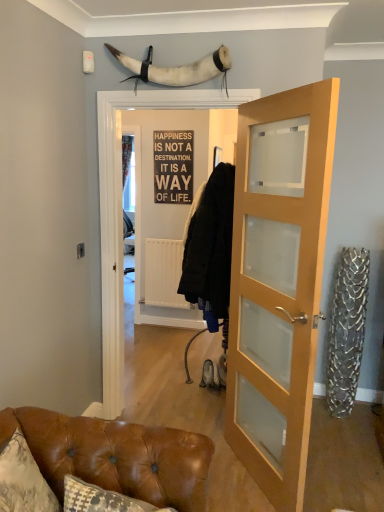
Question: Does white fur horn at upper center have a larger size compared to light wood/glass door at center?

Choices:
 (A) no
 (B) yes

Answer: (A)

Question: From a real-world perspective, is white fur horn at upper center over light wood/glass door at center?

Choices:
 (A) no
 (B) yes

Answer: (B)

Question: Considering the relative sizes of white fur horn at upper center and light wood/glass door at center in the image provided, is white fur horn at upper center wider than light wood/glass door at center?

Choices:
 (A) yes
 (B) no

Answer: (A)

Question: From the image's perspective, is white fur horn at upper center above light wood/glass door at center?

Choices:
 (A) yes
 (B) no

Answer: (A)

Question: Would you say white fur horn at upper center is outside light wood/glass door at center?

Choices:
 (A) yes
 (B) no

Answer: (A)

Question: Could you tell me if white fur horn at upper center is turned towards light wood/glass door at center?

Choices:
 (A) yes
 (B) no

Answer: (B)

Question: From the image's perspective, does white fur horn at upper center appear lower than brown leather couch at lower left?

Choices:
 (A) no
 (B) yes

Answer: (A)

Question: Is white fur horn at upper center positioned before brown leather couch at lower left?

Choices:
 (A) yes
 (B) no

Answer: (B)

Question: Is white fur horn at upper center smaller than brown leather couch at lower left?

Choices:
 (A) no
 (B) yes

Answer: (A)

Question: Is white fur horn at upper center looking in the opposite direction of brown leather couch at lower left?

Choices:
 (A) yes
 (B) no

Answer: (B)

Question: Can you confirm if white fur horn at upper center is taller than brown leather couch at lower left?

Choices:
 (A) yes
 (B) no

Answer: (A)

Question: Is white fur horn at upper center surrounding brown leather couch at lower left?

Choices:
 (A) no
 (B) yes

Answer: (A)

Question: Does metallic sign at center have a lesser width compared to brown leather couch at lower left?

Choices:
 (A) no
 (B) yes

Answer: (B)